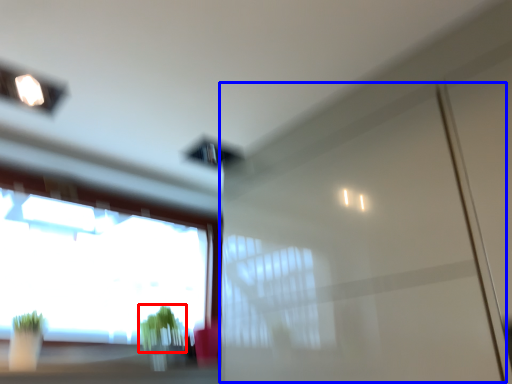
Question: Among these objects, which one is farthest to the camera, plant (highlighted by a red box) or screen door (highlighted by a blue box)?

Choices:
 (A) plant
 (B) screen door

Answer: (A)